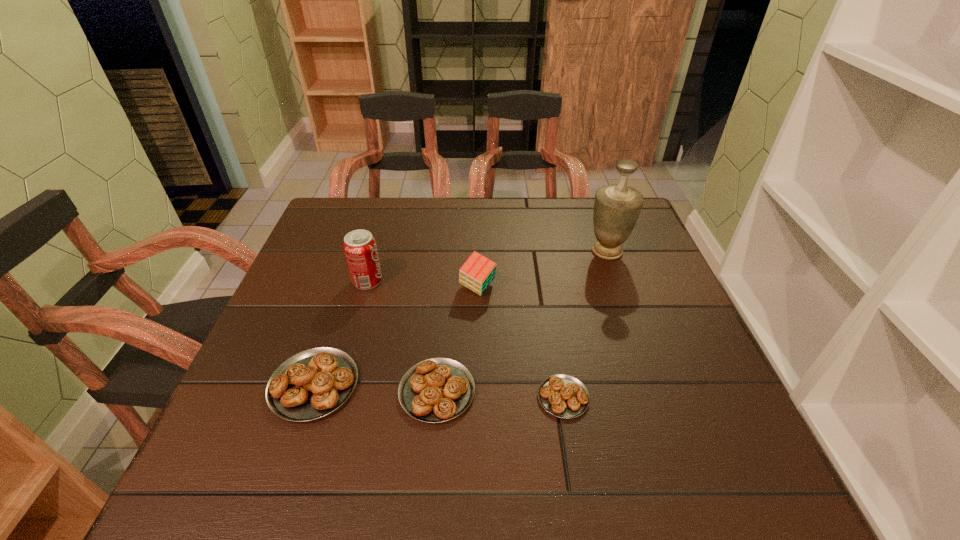
Where is `object at the far right corner`? The width and height of the screenshot is (960, 540). object at the far right corner is located at coordinates (617, 207).

The height and width of the screenshot is (540, 960). Find the location of `vacant space at the far edge of the desktop`. vacant space at the far edge of the desktop is located at coordinates (420, 220).

Find the location of a particular element. The image size is (960, 540). free spot at the near edge of the desktop is located at coordinates (454, 430).

Where is `free region at the left edge of the desktop`? This screenshot has height=540, width=960. free region at the left edge of the desktop is located at coordinates (314, 281).

The image size is (960, 540). Find the location of `vacant region at the right edge of the desktop`. vacant region at the right edge of the desktop is located at coordinates pos(646,303).

Locate an element on the screen. vacant space at the near right corner is located at coordinates (725, 400).

At what (x,y) coordinates should I click in order to perform the action: click on vacant area that lies between the second tallest pastry and the rightmost object. Please return your answer as a coordinate pair (x, y). The height and width of the screenshot is (540, 960). Looking at the image, I should click on (522, 321).

In order to click on unoccupied position between the leftmost pastry and the tallest object in this screenshot , I will do `click(461, 318)`.

Identify the location of vacant area between the rightmost pastry and the rightmost object. (585, 324).

Locate an element on the screen. blank region between the cube and the second object from right to left is located at coordinates (520, 342).